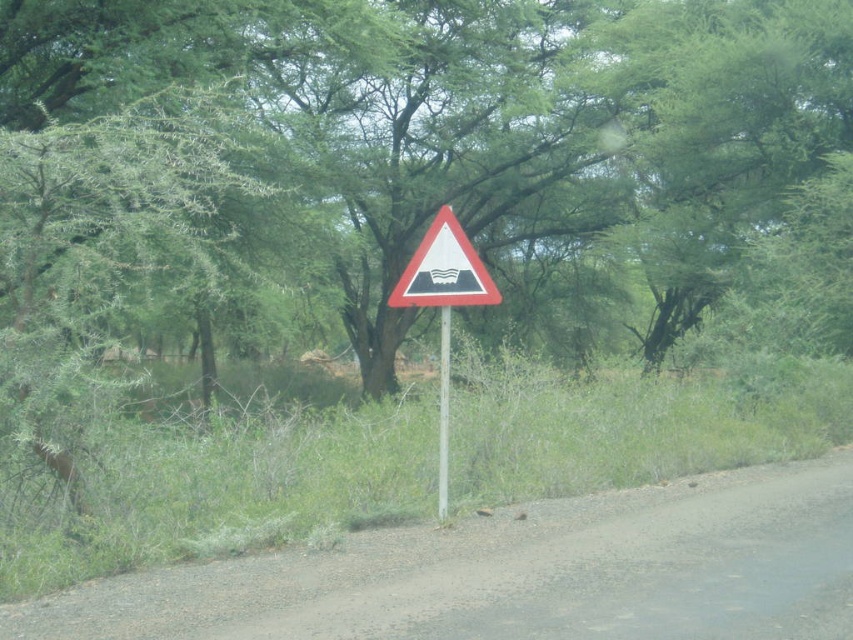
Can you confirm if red plastic triangle at center is taller than white plastic pole at center?

Correct, red plastic triangle at center is much taller as white plastic pole at center.

Can you confirm if red plastic triangle at center is thinner than white plastic pole at center?

Incorrect, red plastic triangle at center's width is not less than white plastic pole at center's.

Which is in front, point (426, 296) or point (444, 435)?

Point (444, 435) is more forward.

This screenshot has height=640, width=853. Identify the location of red plastic triangle at center. (444, 305).

Is red plastic triangle at center below white plastic triangle at center?

Correct, red plastic triangle at center is located below white plastic triangle at center.

Is red plastic triangle at center wider than white plastic triangle at center?

No, red plastic triangle at center is not wider than white plastic triangle at center.

Does point (489, 291) lie in front of point (430, 301)?

Yes, it is in front of point (430, 301).

In order to click on red plastic triangle at center in this screenshot , I will do `click(444, 305)`.

Looking at this image, which is more to the right, white plastic triangle at center or white plastic pole at center?

Positioned to the right is white plastic triangle at center.

Who is lower down, white plastic triangle at center or white plastic pole at center?

white plastic pole at center is lower down.

The image size is (853, 640). What do you see at coordinates (444, 269) in the screenshot?
I see `white plastic triangle at center` at bounding box center [444, 269].

The height and width of the screenshot is (640, 853). I want to click on white plastic triangle at center, so click(444, 269).